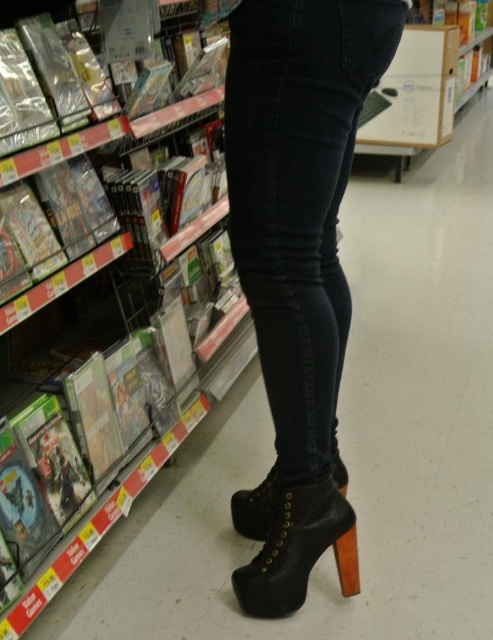
Does point (289, 612) lie in front of point (257, 506)?

Yes, point (289, 612) is closer to viewer.

Which is behind, point (268, 566) or point (260, 538)?

Positioned behind is point (260, 538).

What do you see at coordinates (298, 550) in the screenshot?
I see `black leather boot at lower center` at bounding box center [298, 550].

Image resolution: width=493 pixels, height=640 pixels. I want to click on black leather boot at lower center, so click(298, 550).

Who is lower down, dark blue denim jeans at center or black leather boot at center?

black leather boot at center is below.

Locate an element on the screen. The image size is (493, 640). dark blue denim jeans at center is located at coordinates (298, 196).

Can you confirm if dark blue denim jeans at center is positioned to the left of black leather boot at lower center?

Yes, dark blue denim jeans at center is to the left of black leather boot at lower center.

Can you confirm if dark blue denim jeans at center is shorter than black leather boot at lower center?

No.

Image resolution: width=493 pixels, height=640 pixels. What do you see at coordinates (298, 196) in the screenshot?
I see `dark blue denim jeans at center` at bounding box center [298, 196].

Where is `dark blue denim jeans at center`? The height and width of the screenshot is (640, 493). dark blue denim jeans at center is located at coordinates (298, 196).